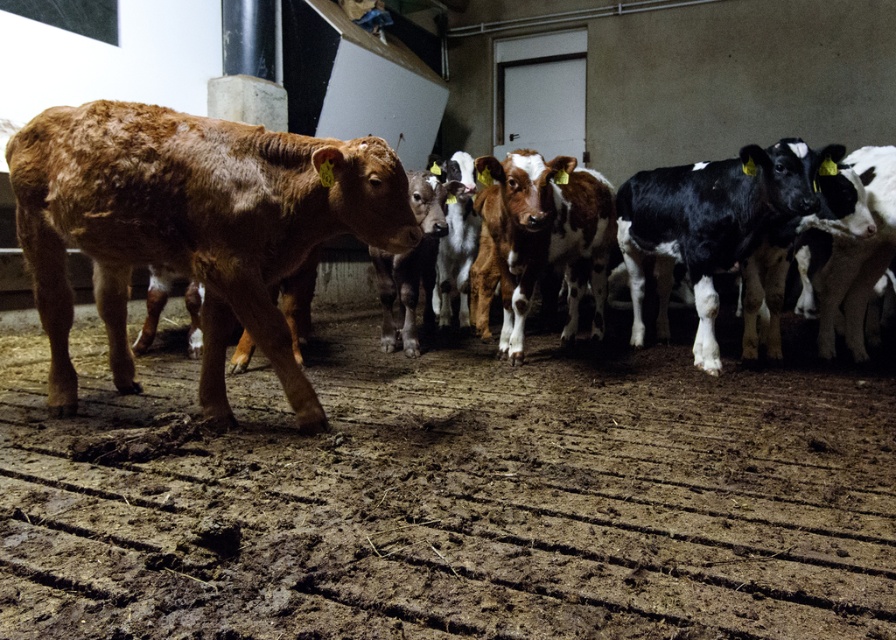
Question: Does brown smooth calf at left have a smaller size compared to brown furry calf at left?

Choices:
 (A) yes
 (B) no

Answer: (A)

Question: Which point is farther from the camera taking this photo?

Choices:
 (A) (145, 161)
 (B) (287, 621)

Answer: (A)

Question: Which point is farther to the camera?

Choices:
 (A) (149, 248)
 (B) (314, 342)
 (C) (67, 115)

Answer: (B)

Question: Can you confirm if brown textured dirt track at center is bigger than brown furry calf at left?

Choices:
 (A) no
 (B) yes

Answer: (B)

Question: Is brown textured dirt track at center positioned at the back of brown furry calf at left?

Choices:
 (A) yes
 (B) no

Answer: (B)

Question: Which point is closer to the camera taking this photo?

Choices:
 (A) coord(220,189)
 (B) coord(304,216)

Answer: (A)